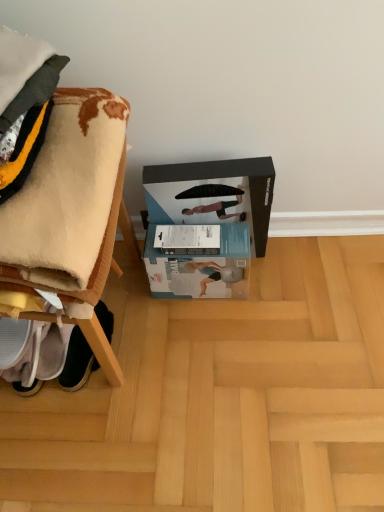
You are a GUI agent. You are given a task and a screenshot of the screen. Output one action in this format:
    pyautogui.click(x=<x>, y=<y>)
    Task: Click on the vacant point above black matte cardboard box at center (from a real-world perspective)
    The width and height of the screenshot is (384, 512).
    Given the screenshot: What is the action you would take?
    pyautogui.click(x=201, y=168)